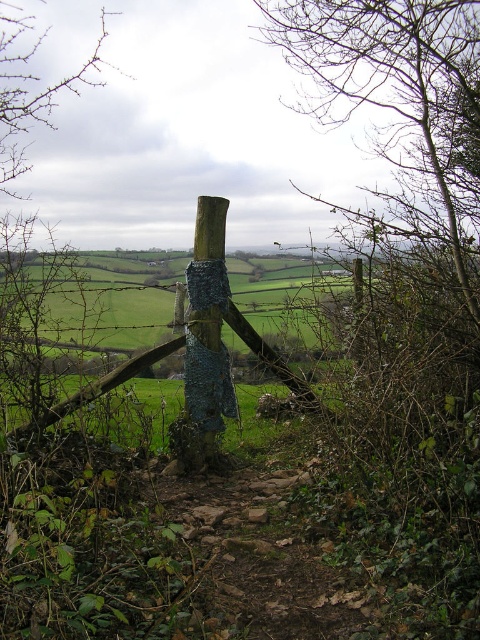
Is blue knitted fabric at center wider than bare branches at upper left?

No.

Between blue knitted fabric at center and bare branches at upper left, which one has more height?

Standing taller between the two is blue knitted fabric at center.

Between point (207, 256) and point (10, 164), which one is positioned behind?

Positioned behind is point (10, 164).

The width and height of the screenshot is (480, 640). I want to click on blue knitted fabric at center, so click(207, 330).